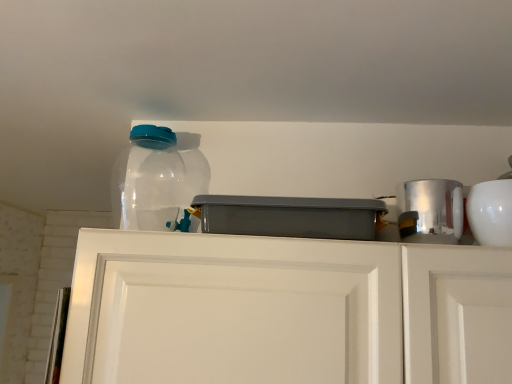
Question: Is silver metallic canister at right, which is the 2th appliance from right to left, looking in the opposite direction of white matte cabinet doors at center?

Choices:
 (A) no
 (B) yes

Answer: (A)

Question: From a real-world perspective, does silver metallic canister at right, which is the 2th appliance from right to left, stand above white matte cabinet doors at center?

Choices:
 (A) no
 (B) yes

Answer: (B)

Question: Is silver metallic canister at right, the 2th appliance from the left, completely or partially outside of white matte cabinet doors at center?

Choices:
 (A) yes
 (B) no

Answer: (A)

Question: Is silver metallic canister at right, which is the 2th appliance from right to left, facing towards white matte cabinet doors at center?

Choices:
 (A) yes
 (B) no

Answer: (B)

Question: Is silver metallic canister at right, the 2th appliance from the left, smaller than white matte cabinet doors at center?

Choices:
 (A) yes
 (B) no

Answer: (A)

Question: Does silver metallic canister at right, which is the 2th appliance from right to left, contain white matte cabinet doors at center?

Choices:
 (A) yes
 (B) no

Answer: (B)

Question: From a real-world perspective, does gray plastic container at center, marked as the third appliance in a right-to-left arrangement, stand above silver metallic canister at right, the 2th appliance from the left?

Choices:
 (A) no
 (B) yes

Answer: (A)

Question: Is gray plastic container at center, marked as the third appliance in a right-to-left arrangement, wider than silver metallic canister at right, which is the 2th appliance from right to left?

Choices:
 (A) no
 (B) yes

Answer: (B)

Question: Is gray plastic container at center, placed as the 1th appliance when sorted from left to right, behind silver metallic canister at right, the 2th appliance from the left?

Choices:
 (A) no
 (B) yes

Answer: (A)

Question: Can you confirm if gray plastic container at center, placed as the 1th appliance when sorted from left to right, is thinner than silver metallic canister at right, the 2th appliance from the left?

Choices:
 (A) yes
 (B) no

Answer: (B)

Question: Is gray plastic container at center, placed as the 1th appliance when sorted from left to right, in contact with silver metallic canister at right, which is the 2th appliance from right to left?

Choices:
 (A) no
 (B) yes

Answer: (A)

Question: Is gray plastic container at center, marked as the third appliance in a right-to-left arrangement, outside silver metallic canister at right, which is the 2th appliance from right to left?

Choices:
 (A) yes
 (B) no

Answer: (A)

Question: Does transparent plastic bottle at upper left appear on the right side of gray plastic container at center, marked as the third appliance in a right-to-left arrangement?

Choices:
 (A) no
 (B) yes

Answer: (A)